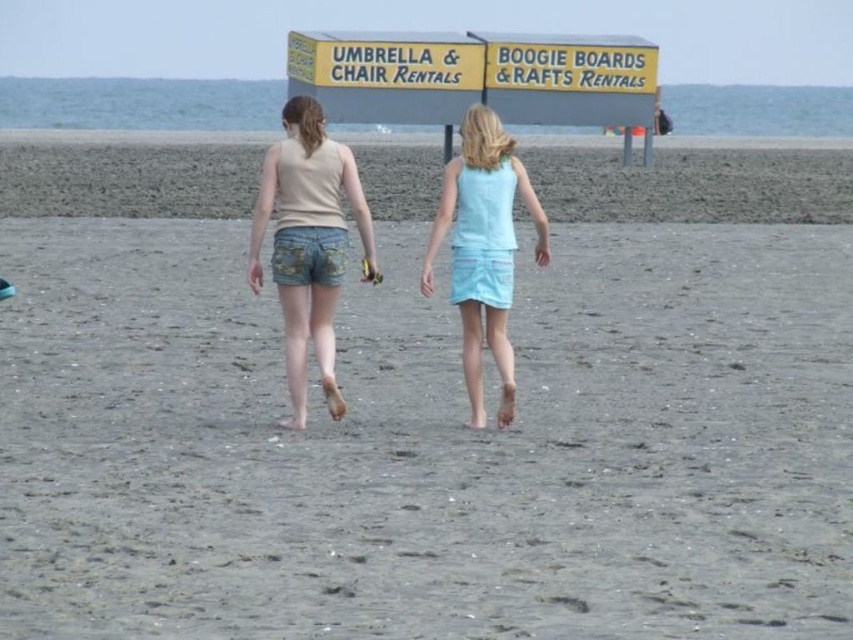
You are standing at the beach and see two points marked on the sand. The first point is at coordinate point (740, 173) and the second is at point (279, 172). Which point is closer to you?

Point (279, 172) is closer to you because it is less further away than point (740, 173).

You are a photographer standing on the beach. You want to take a photo of the gray sand at center without the denim shorts at center appearing in the frame. Based on their positions, is this possible?

The gray sand at center is in front of the denim shorts at center, so the denim shorts at center would block the view of the gray sand at center. Therefore, it is not possible to take a photo of the gray sand at center without the denim shorts at center appearing in the frame.